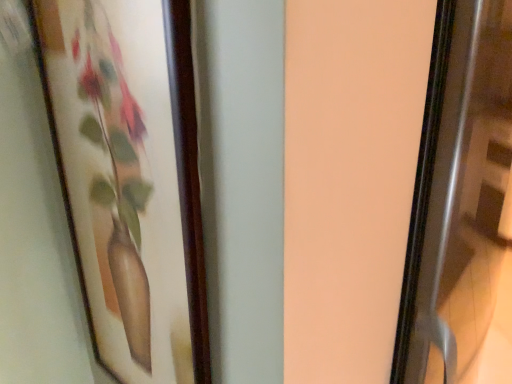
Identify the location of wooden picture frame at left. (130, 178).

This screenshot has height=384, width=512. Describe the element at coordinates (130, 178) in the screenshot. I see `wooden picture frame at left` at that location.

Locate an element on the screen. This screenshot has height=384, width=512. wooden picture frame at left is located at coordinates (130, 178).